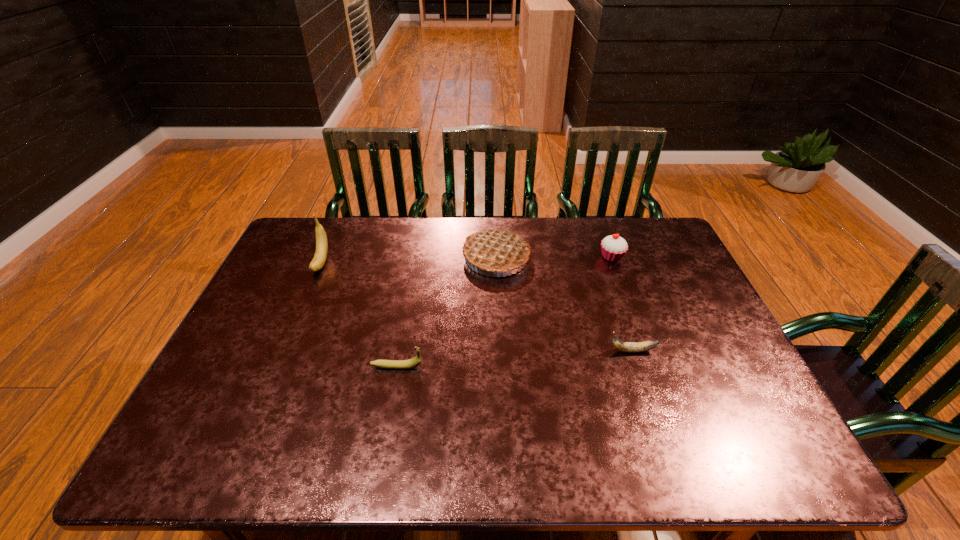
Where is `the third object from right to left`? Image resolution: width=960 pixels, height=540 pixels. the third object from right to left is located at coordinates (496, 250).

Where is `the farthest banana`? the farthest banana is located at coordinates click(320, 256).

This screenshot has height=540, width=960. In order to click on the leftmost banana in this screenshot , I will do `click(320, 256)`.

Locate an element on the screen. This screenshot has width=960, height=540. cupcake is located at coordinates (613, 247).

The height and width of the screenshot is (540, 960). In order to click on the fourth object from right to left in this screenshot , I will do `click(414, 362)`.

At what (x,y) coordinates should I click in order to perform the action: click on the second tallest banana. Please return your answer as a coordinate pair (x, y). Looking at the image, I should click on (414, 362).

Find the location of `the second nearest banana`. the second nearest banana is located at coordinates (630, 347).

Find the location of a particular element. the shortest object is located at coordinates coord(630,347).

Where is `vacant space positioned on the left of the pie`? This screenshot has height=540, width=960. vacant space positioned on the left of the pie is located at coordinates click(410, 258).

Find the location of a particular element. Image resolution: width=960 pixels, height=540 pixels. vacant space located at the start of the peel on the leftmost object is located at coordinates (309, 292).